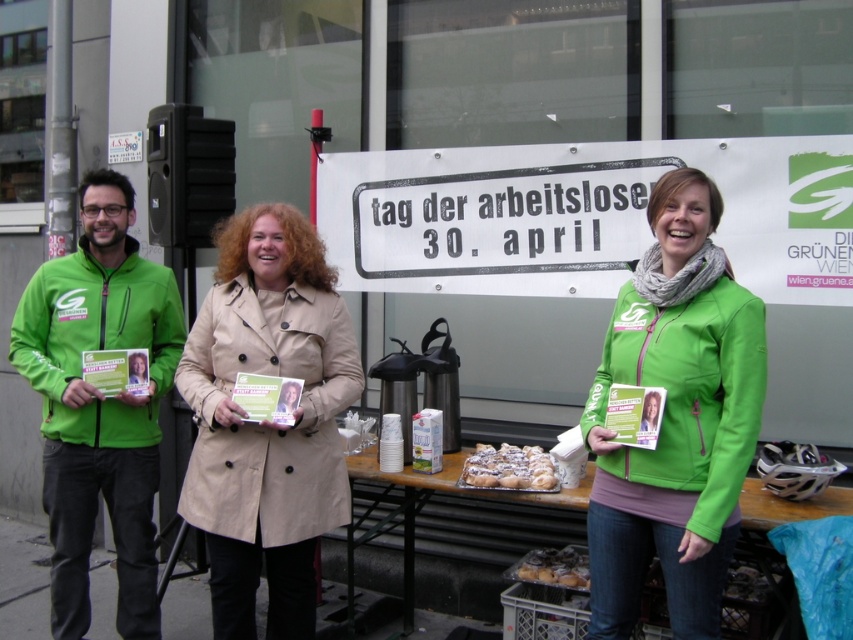
The width and height of the screenshot is (853, 640). I want to click on green softshell jacket at center, so click(x=675, y=419).

Can you confirm if green softshell jacket at center is smaller than wooden table at center?

Yes.

Locate an element on the screen. This screenshot has height=640, width=853. green softshell jacket at center is located at coordinates (675, 419).

Between beige trench coat at center and powdery white pastries at center, which one appears on the right side from the viewer's perspective?

From the viewer's perspective, powdery white pastries at center appears more on the right side.

Who is more distant from viewer, (247, 262) or (549, 492)?

Positioned behind is point (247, 262).

The height and width of the screenshot is (640, 853). Describe the element at coordinates (267, 420) in the screenshot. I see `beige trench coat at center` at that location.

Find the location of a particular element. Image resolution: width=853 pixels, height=640 pixels. beige trench coat at center is located at coordinates (267, 420).

Is beige trench coat at center below golden glazed donuts at center?

Actually, beige trench coat at center is above golden glazed donuts at center.

Is point (241, 323) less distant than point (546, 582)?

Yes, it is in front of point (546, 582).

You are a GUI agent. You are given a task and a screenshot of the screen. Output one action in this format:
    pyautogui.click(x=<x>, y=<y>)
    Task: Click on the beige trench coat at center
    This screenshot has width=853, height=640.
    Given the screenshot: What is the action you would take?
    (x=267, y=420)